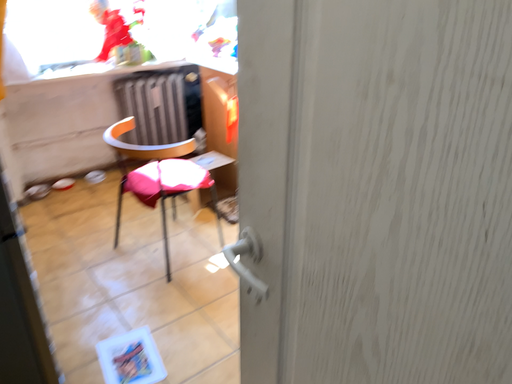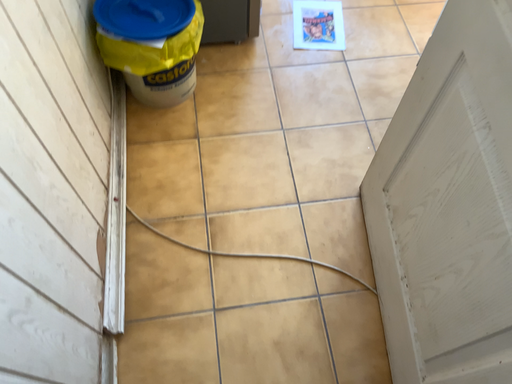
Question: Which way did the camera rotate in the video?

Choices:
 (A) rotated upward
 (B) rotated downward

Answer: (B)